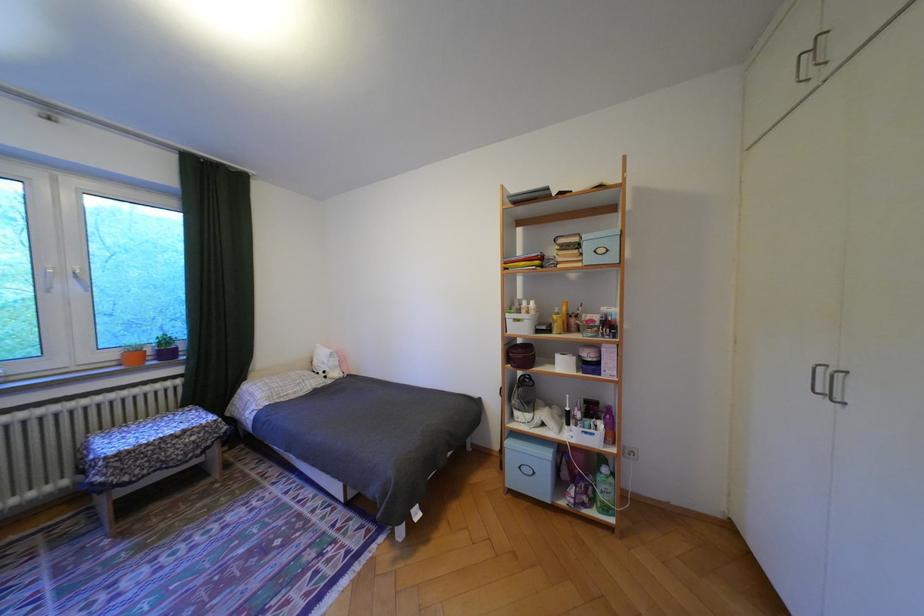
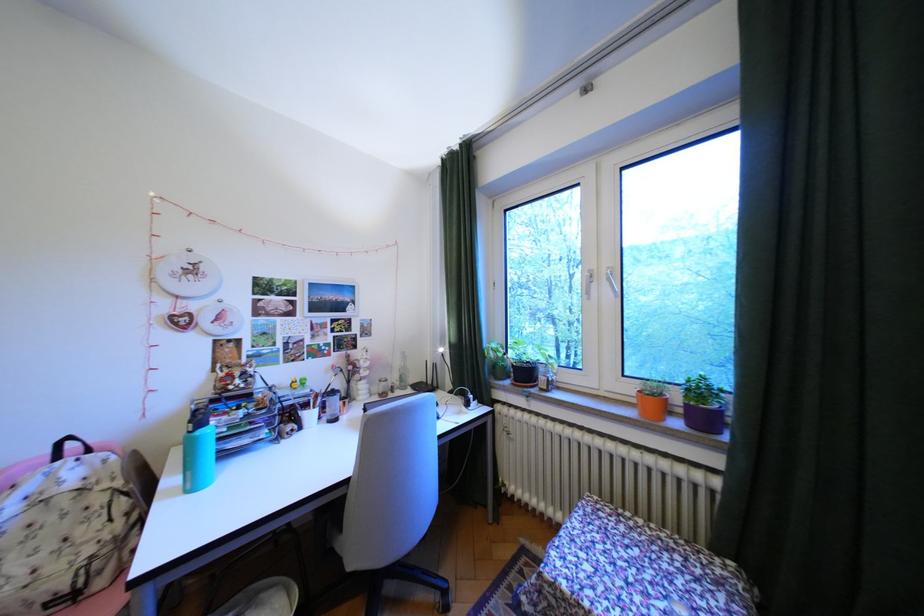
Locate, in the second image, the point that corresponds to pixel 124 355 in the first image.

(641, 390)